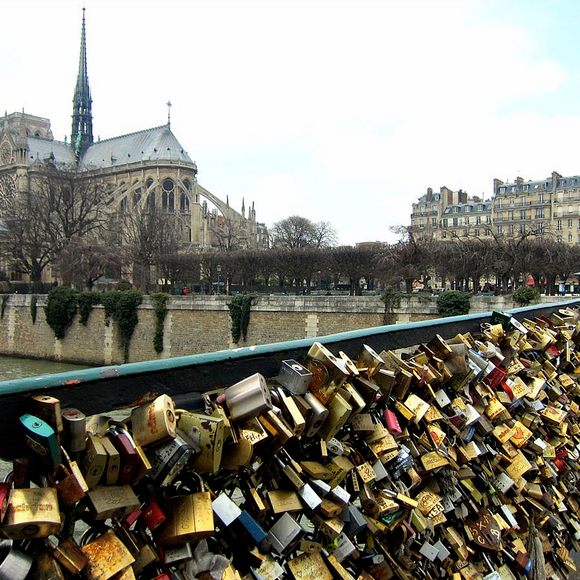
This screenshot has width=580, height=580. Identify the location of green draping plants. (58, 300), (84, 300), (111, 299), (125, 306), (155, 319), (238, 300), (453, 298), (522, 293).